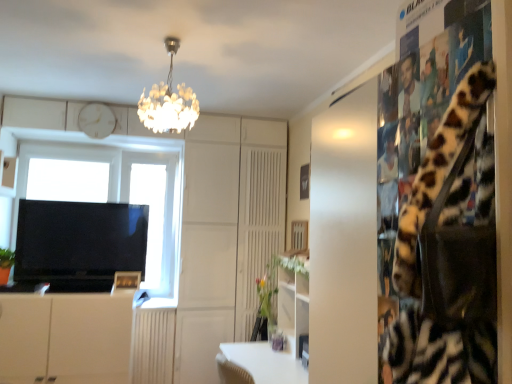
The width and height of the screenshot is (512, 384). What do you see at coordinates (265, 299) in the screenshot? I see `green matte vase at center` at bounding box center [265, 299].

Describe the element at coordinates (65, 338) in the screenshot. I see `white matte cabinet at lower left` at that location.

Find the location of a particular element. The height and width of the screenshot is (384, 512). white matte clock at upper center is located at coordinates (96, 120).

At what (x,y) coordinates should I click in order to perform the action: click on transparent glass window at center. Please return your answer as a coordinate pair (x, y). The image size is (512, 384). Looking at the image, I should click on (118, 192).

From the image's perspective, between transparent glass window at center and white matte clock at upper center, which one is located above?

white matte clock at upper center, from the image's perspective.

Measure the distance between transparent glass window at center and white matte clock at upper center.

transparent glass window at center is 60.77 centimeters from white matte clock at upper center.

From a real-world perspective, between transparent glass window at center and white matte clock at upper center, who is vertically lower?

transparent glass window at center, from a real-world perspective.

Does transparent glass window at center lie behind white matte clock at upper center?

Yes, the depth of transparent glass window at center is greater than that of white matte clock at upper center.

Is white matte clock at upper center behind wooden picture frame at lower center?

Yes.

Locate an element on the screen. picture frame in front of the white matte clock at upper center is located at coordinates (126, 281).

From the image's perspective, which is above, white matte clock at upper center or wooden picture frame at lower center?

From the image's view, white matte clock at upper center is above.

Does white matte clock at upper center have a greater width compared to wooden picture frame at lower center?

Yes, white matte clock at upper center is wider than wooden picture frame at lower center.

Looking at this image, who is shorter, wooden picture frame at lower center or transparent glass window at center?

Standing shorter between the two is wooden picture frame at lower center.

Is point (130, 289) closer or farther from the camera than point (166, 243)?

Point (130, 289).

In the image, is wooden picture frame at lower center on the left side or the right side of transparent glass window at center?

wooden picture frame at lower center is to the right of transparent glass window at center.

Would you say white matte cabinet at lower left is part of wooden picture frame at lower center's contents?

No, wooden picture frame at lower center does not contain white matte cabinet at lower left.

In the scene shown: Can you tell me how much wooden picture frame at lower center and white matte cabinet at lower left differ in facing direction?

The angle between the facing direction of wooden picture frame at lower center and the facing direction of white matte cabinet at lower left is 0.806 degrees.

From a real-world perspective, which is physically below, wooden picture frame at lower center or white matte cabinet at lower left?

From a 3D spatial view, white matte cabinet at lower left is below.

Considering the relative sizes of wooden picture frame at lower center and white matte cabinet at lower left in the image provided, is wooden picture frame at lower center taller than white matte cabinet at lower left?

No.

Consider the image. From a real-world perspective, between black glossy tv at left and white matte clock at upper center, who is vertically higher?

In real-world perspective, white matte clock at upper center is above.

Is the depth of black glossy tv at left less than that of white matte clock at upper center?

Yes, it is in front of white matte clock at upper center.

How many degrees apart are the facing directions of black glossy tv at left and white matte clock at upper center?

The angular difference between black glossy tv at left and white matte clock at upper center is 1.72 degrees.

Is black glossy tv at left next to white matte clock at upper center?

They are not placed beside each other.

Where is `plant below the wooden picture frame at lower center (from the image's perspective)`? The image size is (512, 384). plant below the wooden picture frame at lower center (from the image's perspective) is located at coordinates (265, 299).

Relative to wooden picture frame at lower center, is green matte vase at center in front or behind?

green matte vase at center is positioned closer to the viewer than wooden picture frame at lower center.

Is green matte vase at center inside the boundaries of wooden picture frame at lower center, or outside?

green matte vase at center is not inside wooden picture frame at lower center, it's outside.

From the image's perspective, which one is positioned higher, green matte vase at center or wooden picture frame at lower center?

wooden picture frame at lower center is shown above in the image.

From a real-world perspective, which is physically below, white matte cabinet at lower left or transparent glass window at center?

From a 3D spatial view, white matte cabinet at lower left is below.

Identify the location of cabinetry located on the right of transparent glass window at center. (65, 338).

Is the position of white matte cabinet at lower left more distant than that of transparent glass window at center?

That is False.

Is transparent glass window at center at the back of white matte cabinet at lower left?

No, transparent glass window at center is not at the back of white matte cabinet at lower left.

What are the coordinates of `clock located in front of the transparent glass window at center` in the screenshot? It's located at (96, 120).

Image resolution: width=512 pixels, height=384 pixels. In the image, there is a white matte clock at upper center. Find the location of `picture frame below it (from a real-world perspective)`. picture frame below it (from a real-world perspective) is located at coordinates pyautogui.click(x=126, y=281).

Based on their spatial positions, is transparent glass window at center or black glossy tv at left closer to white glossy computer desk at center?

black glossy tv at left.

Based on their spatial positions, is white matte clock at upper center or white matte cabinet at lower left closer to wooden picture frame at lower center?

The object closer to wooden picture frame at lower center is white matte cabinet at lower left.

Based on their spatial positions, is green matte vase at center or wooden picture frame at lower center closer to white matte cabinet at lower left?

Based on the image, wooden picture frame at lower center appears to be nearer to white matte cabinet at lower left.

Estimate the real-world distances between objects in this image. Which object is further from transparent glass window at center, green matte vase at center or wooden picture frame at lower center?

green matte vase at center lies further to transparent glass window at center than the other object.

Considering their positions, is wooden picture frame at lower center positioned closer to black glossy tv at left than green matte vase at center?

wooden picture frame at lower center lies closer to black glossy tv at left than the other object.

When comparing their distances from transparent glass window at center, does green matte vase at center or black glossy tv at left seem closer?

black glossy tv at left lies closer to transparent glass window at center than the other object.

Consider the image. Considering their positions, is white matte cabinet at lower left positioned closer to black glossy tv at left than wooden picture frame at lower center?

wooden picture frame at lower center lies closer to black glossy tv at left than the other object.

Looking at the image, which one is located further to green matte vase at center, white matte clock at upper center or wooden picture frame at lower center?

white matte clock at upper center lies further to green matte vase at center than the other object.

Identify the location of computer desk between wooden picture frame at lower center and green matte vase at center from left to right. (270, 343).

You are a GUI agent. You are given a task and a screenshot of the screen. Output one action in this format:
    pyautogui.click(x=<x>, y=<y>)
    Task: Click on the picture frame between white matte cabinet at lower left and transparent glass window at center along the z-axis
    The height and width of the screenshot is (384, 512).
    Given the screenshot: What is the action you would take?
    pyautogui.click(x=126, y=281)

You are a GUI agent. You are given a task and a screenshot of the screen. Output one action in this format:
    pyautogui.click(x=<x>, y=<y>)
    Task: Click on the plant between white matte clock at upper center and white glossy computer desk at center from top to bottom
    
    Given the screenshot: What is the action you would take?
    pyautogui.click(x=265, y=299)

Locate an element on the screen. The image size is (512, 384). computer desk between black glossy tv at left and green matte vase at center is located at coordinates (270, 343).